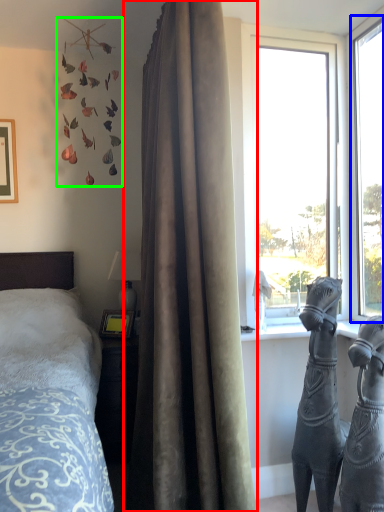
Question: Based on their relative distances, which object is farther from curtain (highlighted by a red box)? Choose from window (highlighted by a blue box) and art (highlighted by a green box).

Choices:
 (A) window
 (B) art

Answer: (B)